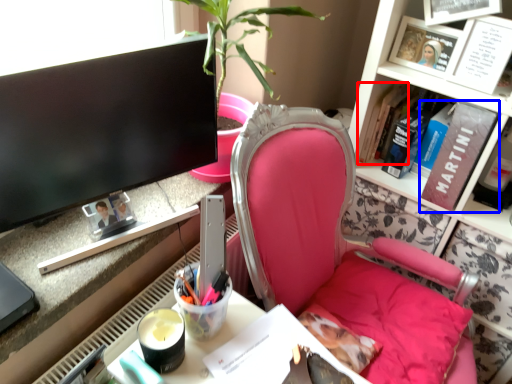
Question: Among these objects, which one is nearest to the camera, book (highlighted by a red box) or book (highlighted by a blue box)?

Choices:
 (A) book
 (B) book

Answer: (B)